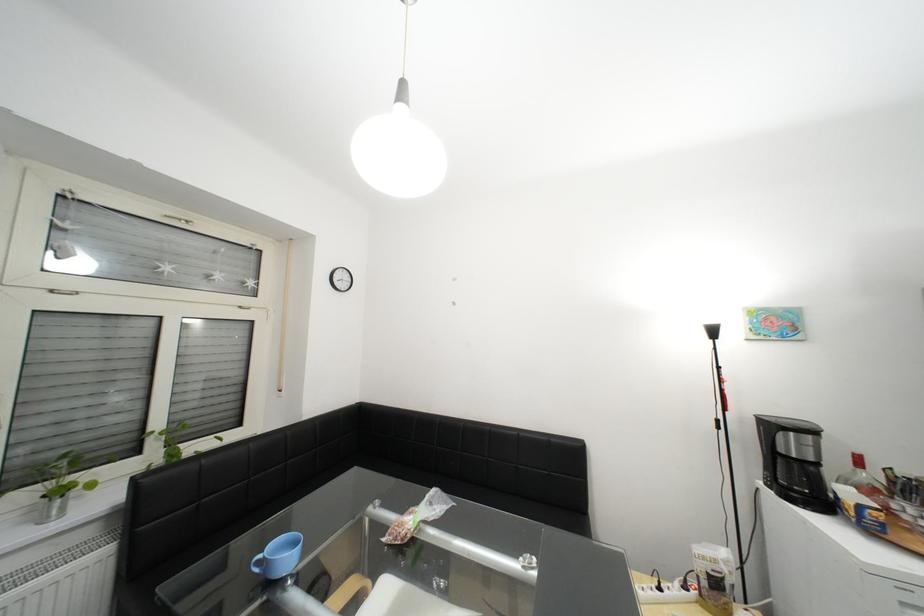
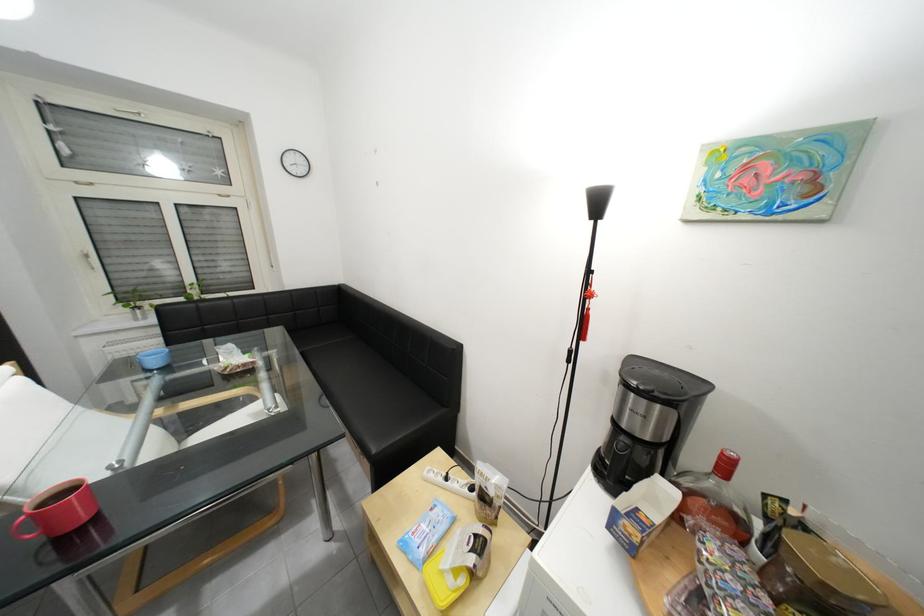
The point at (672,590) is marked in the first image. Where is the corresponding point in the second image?

(457, 479)